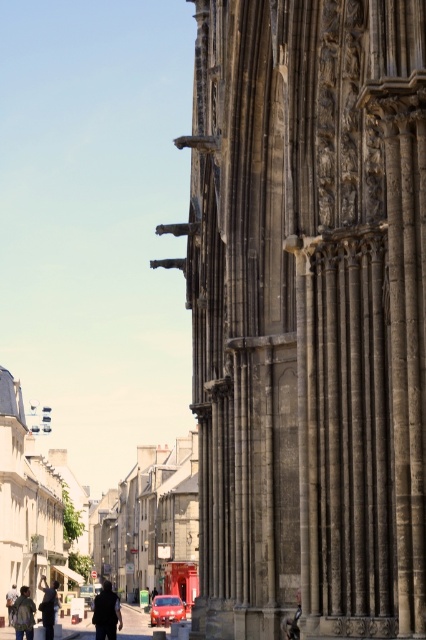
Question: Can you confirm if dark stone columns at right is positioned below denim jacket at lower left?

Choices:
 (A) yes
 (B) no

Answer: (B)

Question: Is dark stone columns at right behind shiny red car at center?

Choices:
 (A) no
 (B) yes

Answer: (A)

Question: Which point is farther from the camera taking this photo?

Choices:
 (A) (43, 580)
 (B) (103, 628)

Answer: (A)

Question: Does concrete pavement at lower center have a lesser width compared to shiny red car at center?

Choices:
 (A) yes
 (B) no

Answer: (B)

Question: Which point appears closest to the camera in this image?

Choices:
 (A) (14, 595)
 (B) (155, 616)
 (C) (290, 627)
 (D) (259, 436)

Answer: (C)

Question: Considering the real-world distances, which object is farthest from the dark stone columns at right?

Choices:
 (A) dark gray stone statue at lower right
 (B) denim jacket at lower left
 (C) concrete pavement at lower center
 (D) shiny red car at center

Answer: (D)